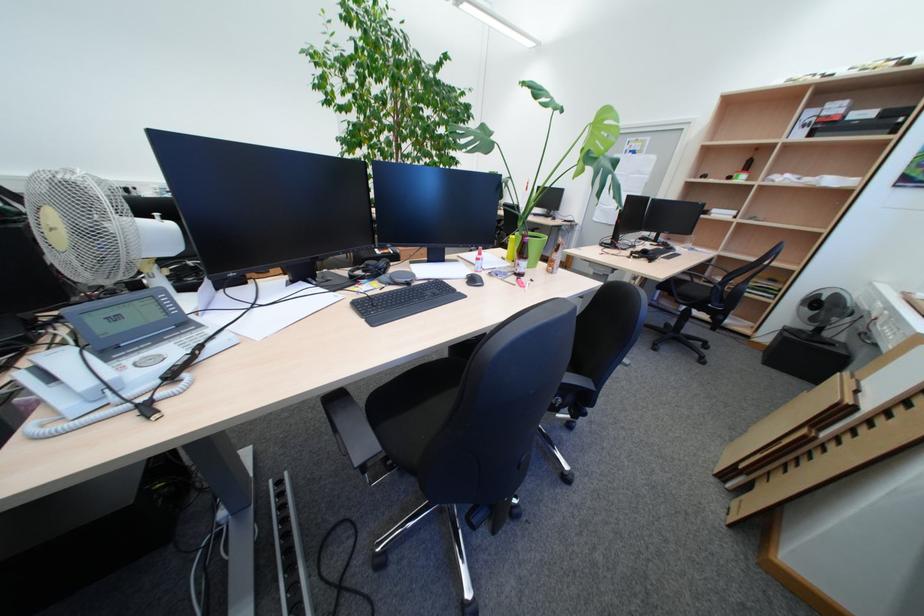
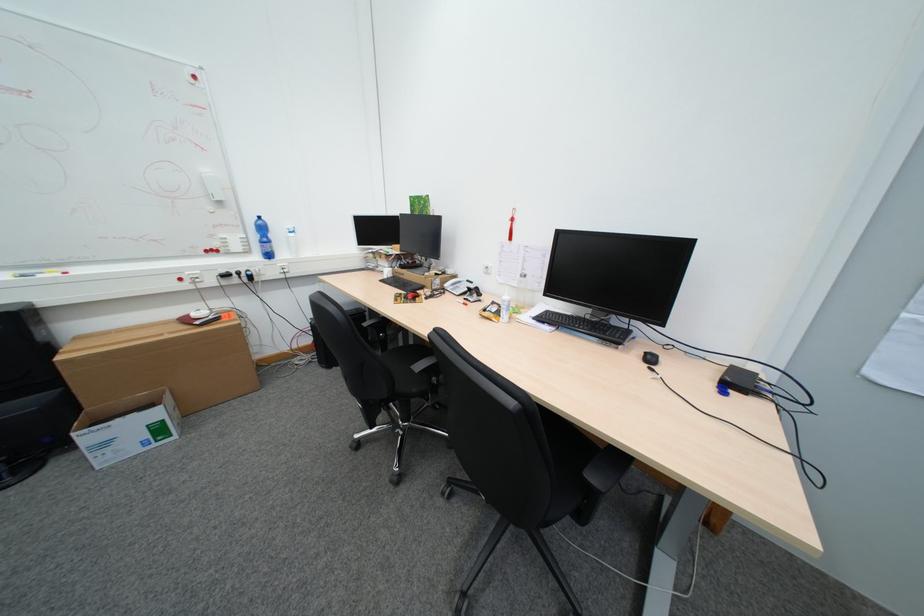
Question: What movement of the cameraman would produce the second image?

Choices:
 (A) Left
 (B) Right
 (C) Forward
 (D) Backward

Answer: (C)